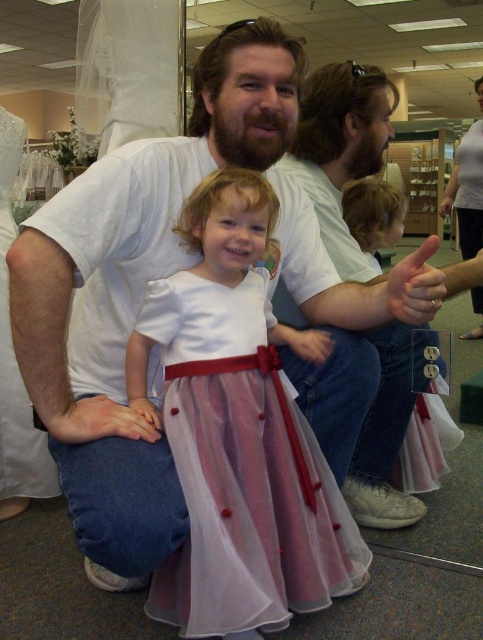
You are a photographer in a bridal shop and you see the pink tulle dress at lower center and the pink tulle dress at center. Which one is more to the left?

The pink tulle dress at lower center is more to the left side of the pink tulle dress at center.

You are a photographer in the bridal shop. You notice the pink tulle dress at lower center and the matte white hand at center. Which object is positioned higher in the image?

The pink tulle dress at lower center is above the matte white hand at center, so the pink tulle dress at lower center is higher.

You are a photographer trying to capture a clear shot of the pink tulle dress at lower center and the pink matte skin at lower left. Since both are pink, which object is easier to see in the photo?

The pink tulle dress at lower center is positioned over the pink matte skin at lower left, so the dress is more visible because it is layered on top.